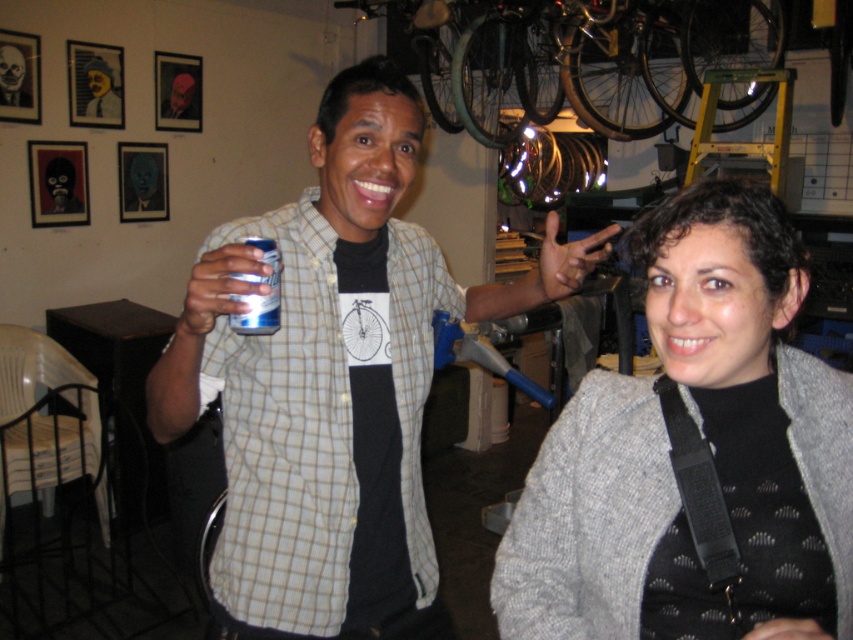
I want to click on matte black can at center, so click(331, 388).

You are a GUI agent. You are given a task and a screenshot of the screen. Output one action in this format:
    pyautogui.click(x=<x>, y=<y>)
    Task: Click on the matte black can at center
    The height and width of the screenshot is (640, 853).
    Given the screenshot: What is the action you would take?
    pyautogui.click(x=331, y=388)

Does matte black can at center have a larger size compared to silver metallic can at center?

Correct, matte black can at center is larger in size than silver metallic can at center.

Which is behind, point (257, 406) or point (279, 285)?

The point (257, 406) is behind.

Between point (381, 360) and point (277, 296), which one is positioned in front?

Point (277, 296) is in front.

What are the coordinates of `matte black can at center` in the screenshot? It's located at (331, 388).

Which is in front, point (578, 417) or point (257, 332)?

Point (257, 332) is more forward.

Is point (720, 419) positioned before point (233, 330)?

Yes, point (720, 419) is in front of point (233, 330).

This screenshot has height=640, width=853. What do you see at coordinates (756, 397) in the screenshot? I see `gray wool sweater at center` at bounding box center [756, 397].

Locate an element on the screen. The width and height of the screenshot is (853, 640). gray wool sweater at center is located at coordinates (756, 397).